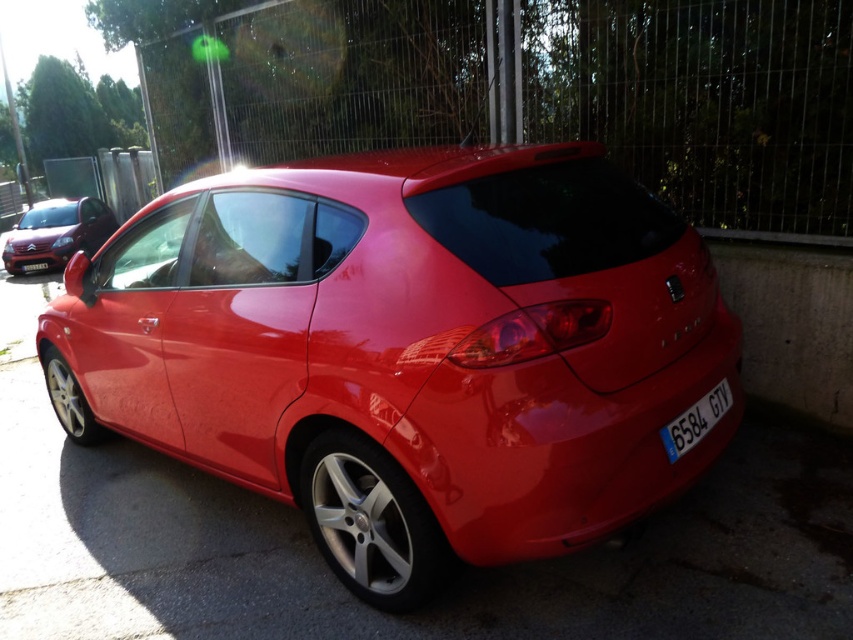
Looking at this image, can you confirm if glossy red car at center is positioned to the right of white plastic license plate at center?

Correct, you'll find glossy red car at center to the right of white plastic license plate at center.

Is glossy red car at center shorter than white plastic license plate at center?

Incorrect, glossy red car at center's height does not fall short of white plastic license plate at center's.

Who is more forward, (100,419) or (24,269)?

Positioned in front is point (100,419).

The image size is (853, 640). In order to click on glossy red car at center in this screenshot , I will do `click(405, 349)`.

Who is positioned more to the right, glossy metallic car at left or white plastic license plate at center?

Positioned to the right is white plastic license plate at center.

Does glossy metallic car at left have a lesser height compared to white plastic license plate at center?

In fact, glossy metallic car at left may be taller than white plastic license plate at center.

Who is more forward, (49, 221) or (28, 269)?

Point (28, 269) is in front.

You are a GUI agent. You are given a task and a screenshot of the screen. Output one action in this format:
    pyautogui.click(x=<x>, y=<y>)
    Task: Click on the glossy metallic car at left
    
    Given the screenshot: What is the action you would take?
    pyautogui.click(x=57, y=232)

Between point (109, 376) and point (711, 426), which one is positioned in front?

Point (711, 426) is in front.

Does point (405, 385) lie in front of point (705, 404)?

Yes, it is.

This screenshot has height=640, width=853. I want to click on glossy red car at center, so coord(405,349).